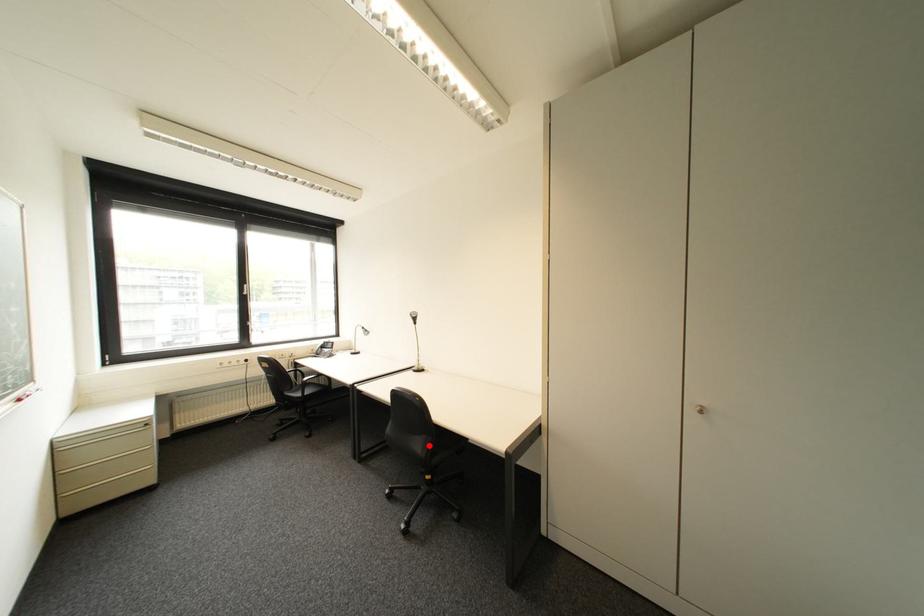
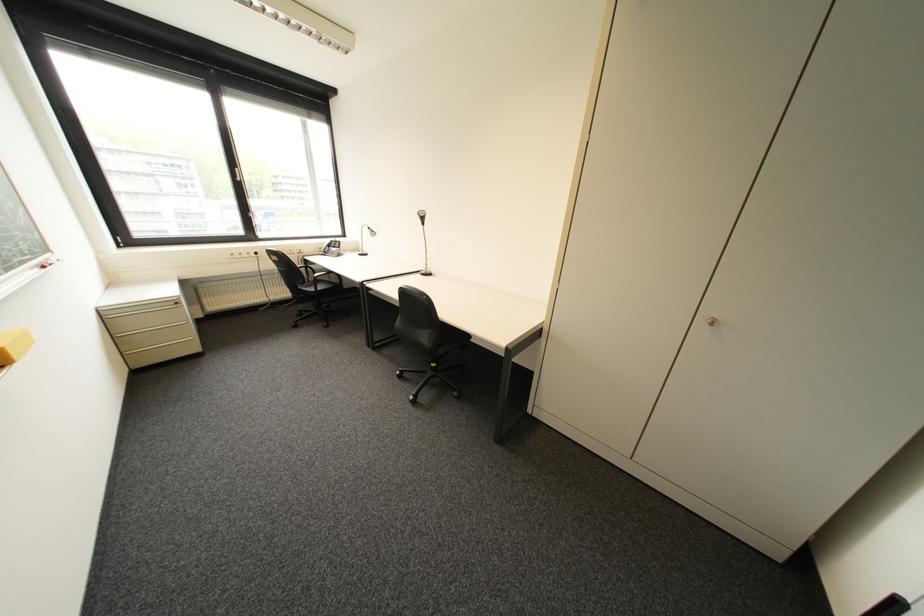
The point at the highlighted location is marked in the first image. Where is the corresponding point in the second image?

(435, 338)